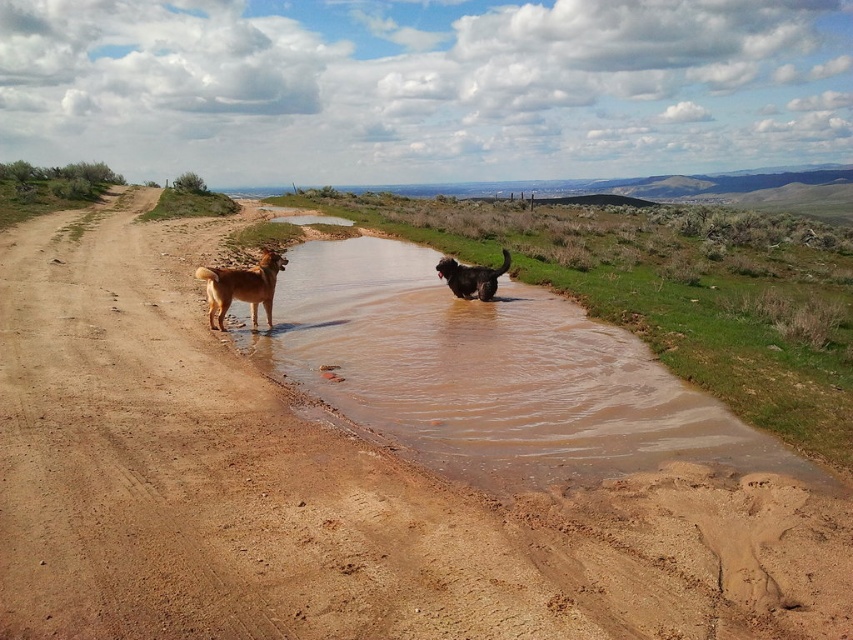
Question: Is brown muddy water at center thinner than shiny black fur at center?

Choices:
 (A) yes
 (B) no

Answer: (B)

Question: Among these points, which one is nearest to the camera?

Choices:
 (A) (260, 390)
 (B) (247, 300)

Answer: (A)

Question: Which of the following is the farthest from the observer?

Choices:
 (A) (252, 321)
 (B) (32, 221)
 (C) (485, 285)

Answer: (B)

Question: Which point is farther to the camera?

Choices:
 (A) (451, 262)
 (B) (221, 289)

Answer: (A)

Question: Is brown sandy dirt at center above shiny black fur at center?

Choices:
 (A) no
 (B) yes

Answer: (A)

Question: In this image, where is brown muddy water at center located relative to brown furry dog at left?

Choices:
 (A) left
 (B) right

Answer: (B)